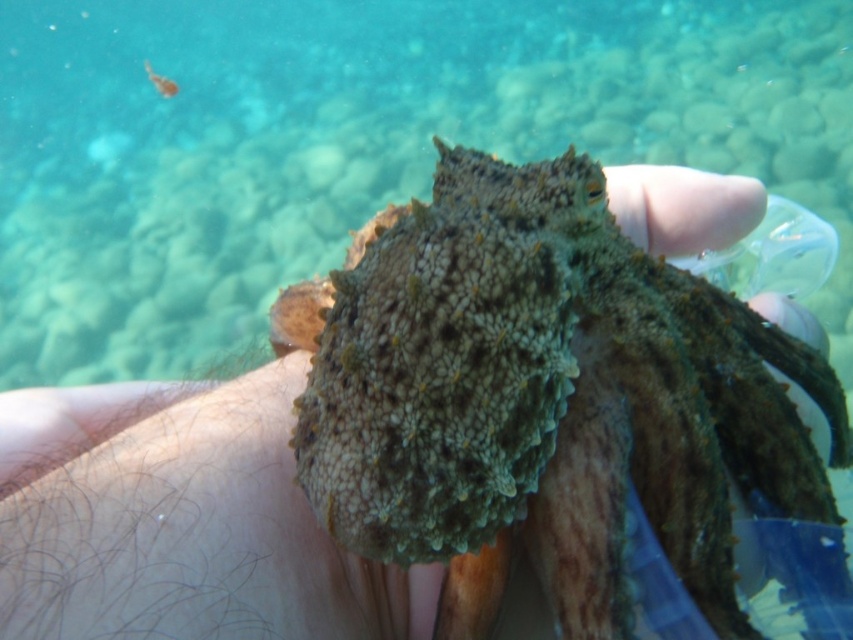
Question: Which object is closer to the camera taking this photo?

Choices:
 (A) camouflage textured octopus at center
 (B) hairless skin at lower center
 (C) translucent orange fish at upper left

Answer: (B)

Question: Does camouflage textured octopus at center have a lesser width compared to translucent orange fish at upper left?

Choices:
 (A) no
 (B) yes

Answer: (A)

Question: Is camouflage textured octopus at center above hairless skin at lower center?

Choices:
 (A) yes
 (B) no

Answer: (A)

Question: Can you confirm if camouflage textured octopus at center is smaller than hairless skin at lower center?

Choices:
 (A) no
 (B) yes

Answer: (A)

Question: Which object appears farthest from the camera in this image?

Choices:
 (A) camouflage textured octopus at center
 (B) hairless skin at lower center
 (C) translucent orange fish at upper left

Answer: (C)

Question: Which object appears closest to the camera in this image?

Choices:
 (A) hairless skin at lower center
 (B) camouflage textured octopus at center
 (C) translucent orange fish at upper left

Answer: (A)